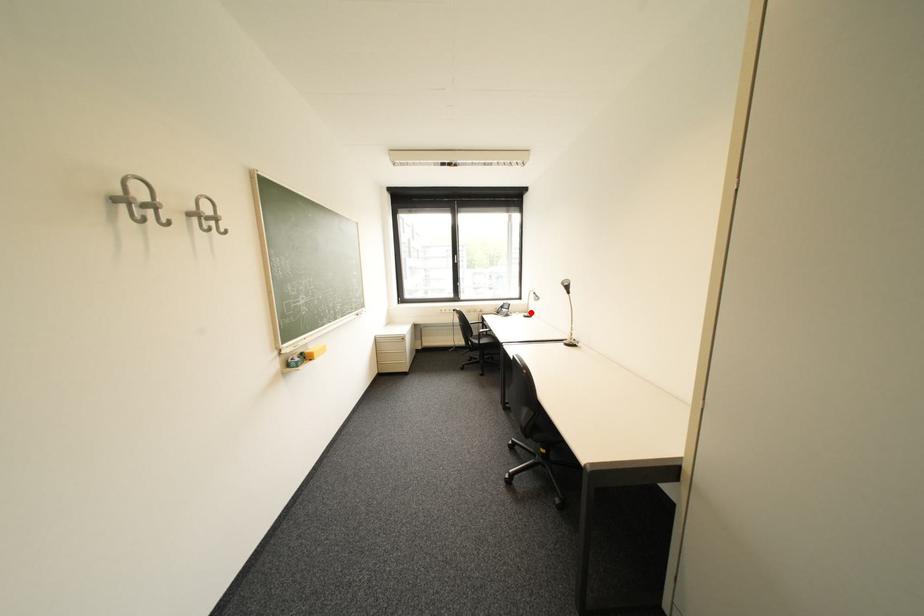
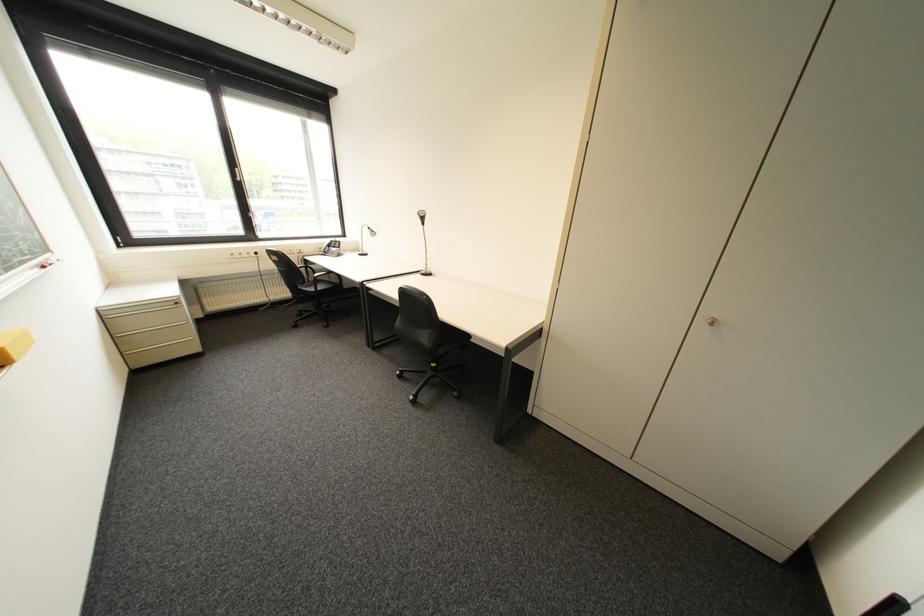
In the second image, find the point that corresponds to the highlighted location in the first image.

(362, 252)